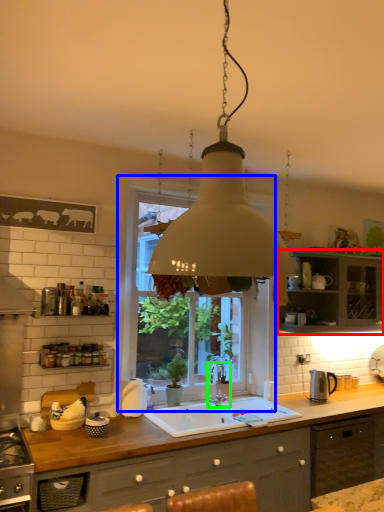
Question: Which object is the farthest from cabinetry (highlighted by a red box)? Choose among these: window (highlighted by a blue box) or tap (highlighted by a green box).

Choices:
 (A) window
 (B) tap

Answer: (B)